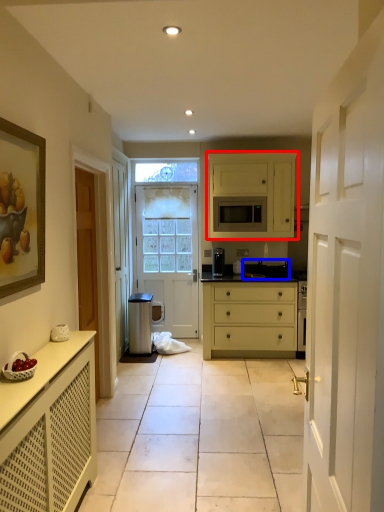
Question: Among these objects, which one is nearest to the camera, cabinetry (highlighted by a red box) or appliance (highlighted by a blue box)?

Choices:
 (A) cabinetry
 (B) appliance

Answer: (A)